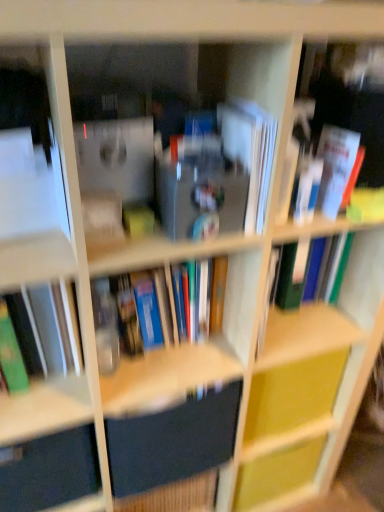
Question: Would you consider hardcover book at center, which ranks as the 3th book in right-to-left order, to be distant from dark blue matte book at center, positioned as the second paperback book in top-to-bottom order?

Choices:
 (A) yes
 (B) no

Answer: (B)

Question: Is hardcover book at center, the second book in the left-to-right sequence, placed right next to dark blue matte book at center, positioned as the second paperback book in top-to-bottom order?

Choices:
 (A) no
 (B) yes

Answer: (A)

Question: Can you confirm if hardcover book at center, the second book in the left-to-right sequence, is shorter than dark blue matte book at center, positioned as the second paperback book in top-to-bottom order?

Choices:
 (A) no
 (B) yes

Answer: (B)

Question: Could you tell me if hardcover book at center, which ranks as the 3th book in right-to-left order, is facing dark blue matte book at center, positioned as the second paperback book in top-to-bottom order?

Choices:
 (A) no
 (B) yes

Answer: (A)

Question: Can you confirm if hardcover book at center, the second book in the left-to-right sequence, is smaller than dark blue matte book at center, marked as the first paperback book in a bottom-to-top arrangement?

Choices:
 (A) no
 (B) yes

Answer: (A)

Question: From a real-world perspective, is hardcover book at center, the second book in the left-to-right sequence, below dark blue matte book at center, positioned as the second paperback book in top-to-bottom order?

Choices:
 (A) no
 (B) yes

Answer: (A)

Question: Is matte black drawer at lower left surrounded by dark blue matte book at center, positioned as the second paperback book in top-to-bottom order?

Choices:
 (A) yes
 (B) no

Answer: (B)

Question: From the image's perspective, would you say dark blue matte book at center, positioned as the second paperback book in top-to-bottom order, is shown under matte black drawer at lower left?

Choices:
 (A) no
 (B) yes

Answer: (A)

Question: Is dark blue matte book at center, marked as the first paperback book in a bottom-to-top arrangement, thinner than matte black drawer at lower left?

Choices:
 (A) no
 (B) yes

Answer: (A)

Question: Is the depth of dark blue matte book at center, positioned as the second paperback book in top-to-bottom order, greater than that of matte black drawer at lower left?

Choices:
 (A) no
 (B) yes

Answer: (B)

Question: Is dark blue matte book at center, marked as the first paperback book in a bottom-to-top arrangement, at the left side of matte black drawer at lower left?

Choices:
 (A) no
 (B) yes

Answer: (A)

Question: Is dark blue matte book at center, marked as the first paperback book in a bottom-to-top arrangement, positioned before matte black drawer at lower left?

Choices:
 (A) yes
 (B) no

Answer: (B)

Question: Considering the relative sizes of matte black drawer at lower left and white paper at center, marked as the first paperback book in a top-to-bottom arrangement, in the image provided, is matte black drawer at lower left thinner than white paper at center, marked as the first paperback book in a top-to-bottom arrangement,?

Choices:
 (A) yes
 (B) no

Answer: (A)